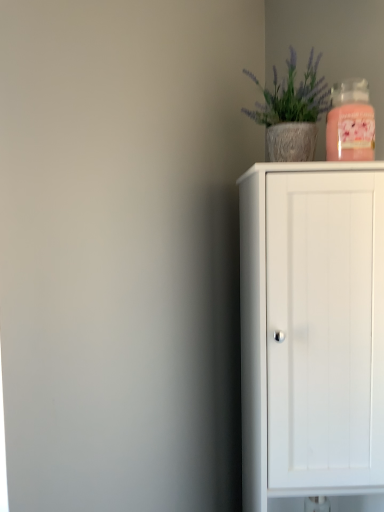
Question: Considering the relative sizes of pink glass candle at upper right and textured concrete pot at upper right in the image provided, is pink glass candle at upper right shorter than textured concrete pot at upper right?

Choices:
 (A) yes
 (B) no

Answer: (A)

Question: Are pink glass candle at upper right and textured concrete pot at upper right making contact?

Choices:
 (A) no
 (B) yes

Answer: (A)

Question: From a real-world perspective, is pink glass candle at upper right on textured concrete pot at upper right?

Choices:
 (A) no
 (B) yes

Answer: (A)

Question: Is pink glass candle at upper right not near textured concrete pot at upper right?

Choices:
 (A) yes
 (B) no

Answer: (B)

Question: From a real-world perspective, is pink glass candle at upper right beneath textured concrete pot at upper right?

Choices:
 (A) yes
 (B) no

Answer: (A)

Question: Considering the relative sizes of pink glass candle at upper right and textured concrete pot at upper right in the image provided, is pink glass candle at upper right thinner than textured concrete pot at upper right?

Choices:
 (A) no
 (B) yes

Answer: (B)

Question: Does white matte cabinet at right turn towards textured concrete pot at upper right?

Choices:
 (A) no
 (B) yes

Answer: (A)

Question: Could textured concrete pot at upper right be considered to be inside white matte cabinet at right?

Choices:
 (A) yes
 (B) no

Answer: (B)

Question: Can you confirm if white matte cabinet at right is positioned to the left of textured concrete pot at upper right?

Choices:
 (A) yes
 (B) no

Answer: (B)

Question: Can you confirm if white matte cabinet at right is bigger than textured concrete pot at upper right?

Choices:
 (A) yes
 (B) no

Answer: (A)

Question: Is white matte cabinet at right positioned in front of textured concrete pot at upper right?

Choices:
 (A) yes
 (B) no

Answer: (A)

Question: Considering the relative sizes of white matte cabinet at right and textured concrete pot at upper right in the image provided, is white matte cabinet at right smaller than textured concrete pot at upper right?

Choices:
 (A) yes
 (B) no

Answer: (B)

Question: From the image's perspective, would you say textured concrete pot at upper right is positioned over pink glass candle at upper right?

Choices:
 (A) no
 (B) yes

Answer: (B)